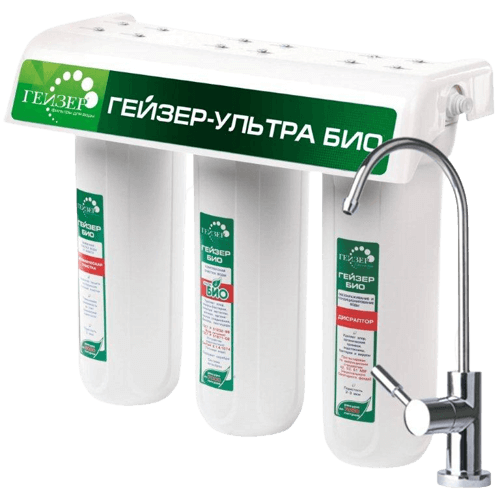
Where is `table`? table is located at coordinates (173, 457).